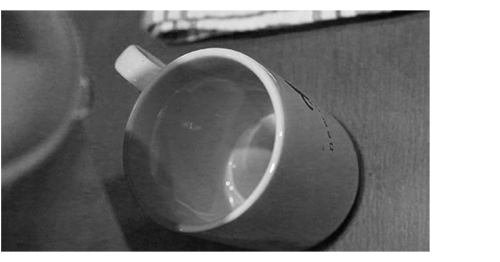
Identify the location of cup. Image resolution: width=500 pixels, height=262 pixels. (277, 116).